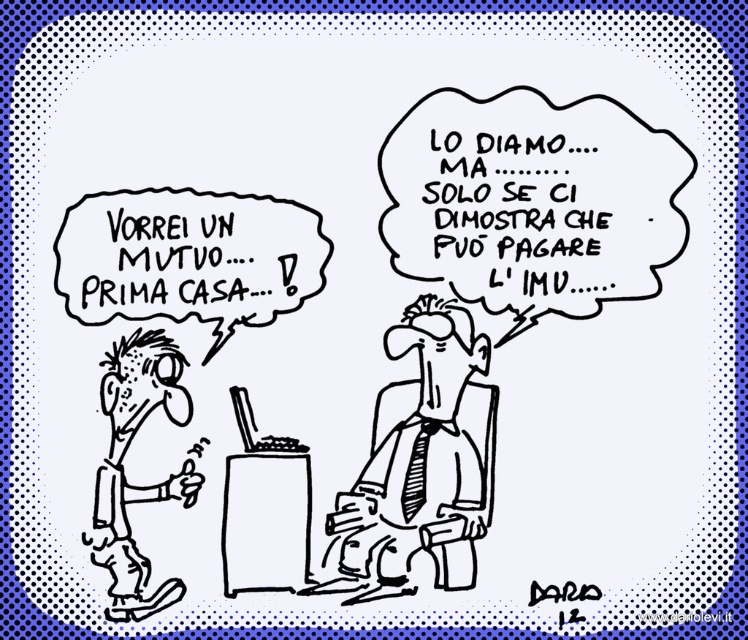
You are a delivery robot with a height of 1.2 meters. You need to pick up the black ink pen at center from a table. The table is 0.7 meters high. Can you reach it?

The black ink pen at center is 1.10 meters away from the camera. Since the table is 0.7 meters high and the robot is 1.2 meters tall, the robot can reach the pen as the distance from the camera does not affect the height required to reach the pen.